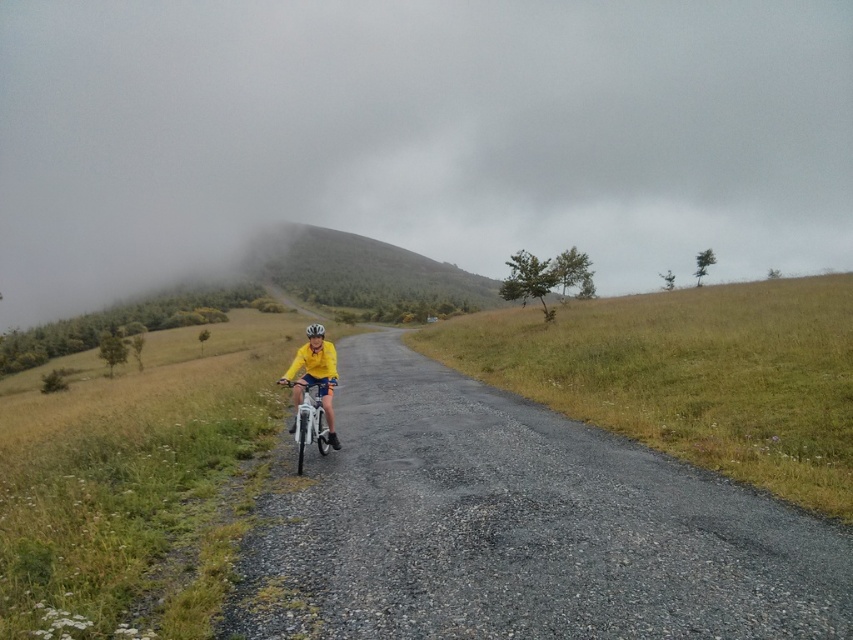
Question: Is foggy misty hillside at upper center thinner than yellow matte jacket at center?

Choices:
 (A) yes
 (B) no

Answer: (B)

Question: Which object is farther from the camera taking this photo?

Choices:
 (A) white matte bicycle at center
 (B) foggy misty hillside at upper center

Answer: (B)

Question: Which point is farther from the camera taking this photo?

Choices:
 (A) (309, 348)
 (B) (418, 284)
 (C) (318, 438)

Answer: (B)

Question: Does yellow matte jacket at center appear on the left side of white matte bicycle at center?

Choices:
 (A) no
 (B) yes

Answer: (B)

Question: Which of the following is the farthest from the observer?

Choices:
 (A) yellow matte jacket at center
 (B) foggy misty hillside at upper center
 (C) green grassy hill at center
 (D) white matte bicycle at center

Answer: (C)

Question: Is green grassy hill at center to the right of yellow matte jacket at center from the viewer's perspective?

Choices:
 (A) no
 (B) yes

Answer: (A)